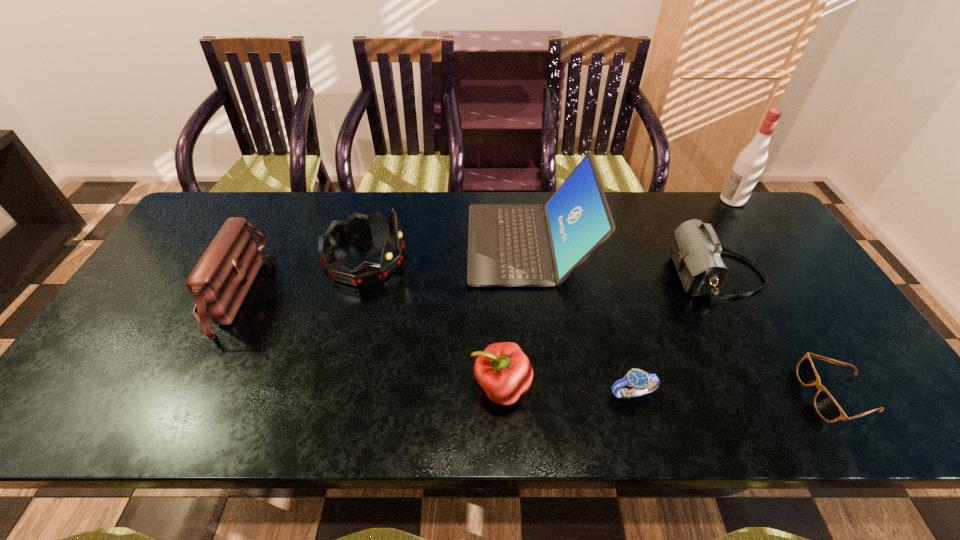
In order to click on free point between the third shortest object and the right shoulder bag in this screenshot , I will do `click(609, 330)`.

At what (x,y) coordinates should I click in order to perform the action: click on free space that is in between the laptop computer and the tallest object. Please return your answer as a coordinate pair (x, y). The width and height of the screenshot is (960, 540). Looking at the image, I should click on (631, 222).

The height and width of the screenshot is (540, 960). Find the location of `blank region between the right shoulder bag and the bell pepper`. blank region between the right shoulder bag and the bell pepper is located at coordinates click(609, 330).

This screenshot has width=960, height=540. In order to click on free point between the seventh tallest object and the right shoulder bag in this screenshot , I will do `click(674, 334)`.

You are a GUI agent. You are given a task and a screenshot of the screen. Output one action in this format:
    pyautogui.click(x=<x>, y=<y>)
    Task: Click on the free area in between the right shoulder bag and the second shortest object
    
    Given the screenshot: What is the action you would take?
    pyautogui.click(x=674, y=334)

Identify the location of free space between the right shoulder bag and the laptop computer. (622, 259).

Image resolution: width=960 pixels, height=540 pixels. Identify the location of free space that is in between the second shortest object and the leftmost object. (432, 342).

Identify the location of unoccupied area between the watch and the tiara. (498, 326).

Find the location of a particular element. The image size is (960, 540). vacant region between the second tallest object and the shortest object is located at coordinates (683, 320).

Identify which object is the sixth nearest to the right shoulder bag. Please provide its 2D coordinates. Your answer should be formatted as a tuple, i.e. [(x, y)], where the tuple contains the x and y coordinates of a point satisfying the conditions above.

[(356, 225)]